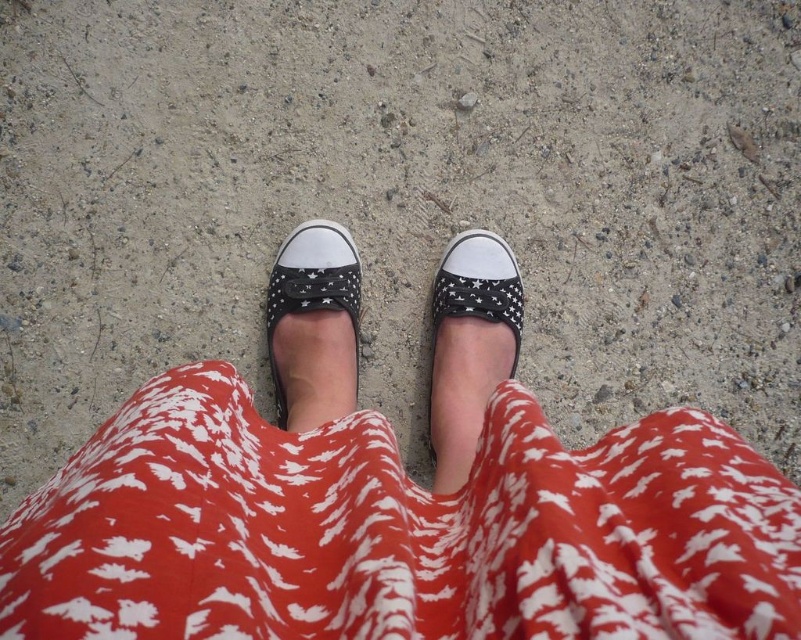
Question: Is white printed fabric skirt at center in front of black canvas slip-on at center?

Choices:
 (A) yes
 (B) no

Answer: (A)

Question: Which point appears closest to the camera in this image?

Choices:
 (A) (337, 257)
 (B) (445, 472)

Answer: (B)

Question: Does white canvas shoe at center appear under black canvas slip-on at center?

Choices:
 (A) no
 (B) yes

Answer: (B)

Question: Does white printed fabric skirt at center appear on the left side of white canvas shoe at center?

Choices:
 (A) yes
 (B) no

Answer: (A)

Question: Which point is closer to the camera?

Choices:
 (A) white printed fabric skirt at center
 (B) black canvas slip-on at center

Answer: (A)

Question: Which of the following is the farthest from the observer?

Choices:
 (A) (244, 602)
 (B) (308, 276)

Answer: (B)